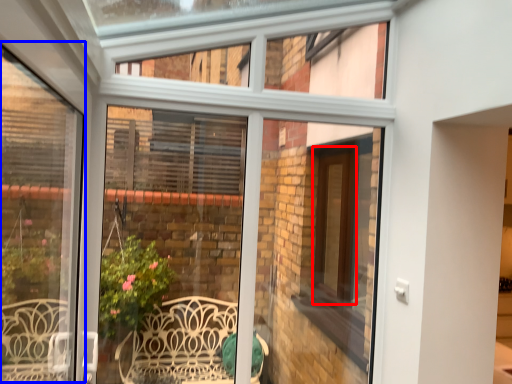
Question: Which object is further to the camera taking this photo, screen door (highlighted by a red box) or window frame (highlighted by a blue box)?

Choices:
 (A) screen door
 (B) window frame

Answer: (A)